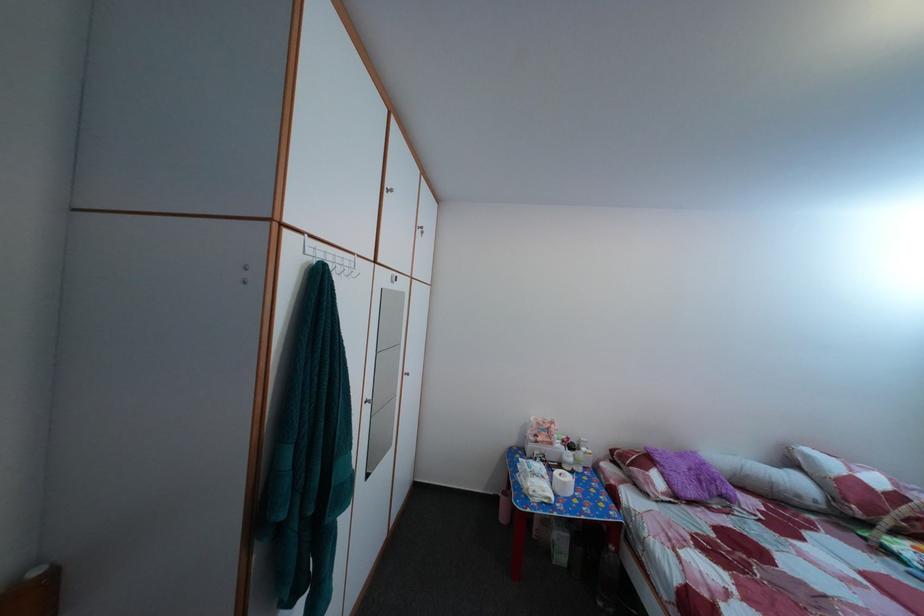
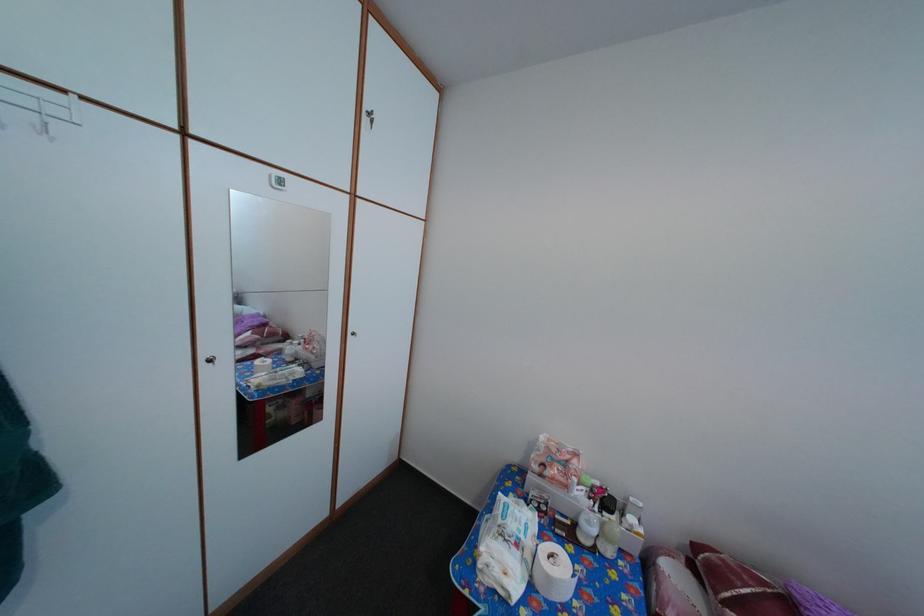
The point at (574, 492) is marked in the first image. Where is the corresponding point in the second image?

(558, 586)